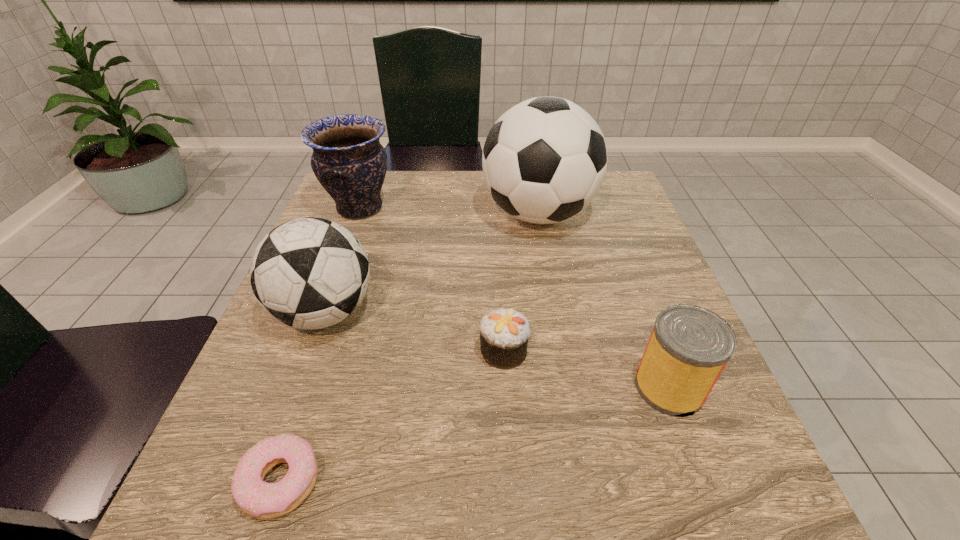
Where is `free space between the pottery and the cupcake`? free space between the pottery and the cupcake is located at coordinates (431, 280).

Locate which object is the second closest to the pottery. Please provide its 2D coordinates. Your answer should be formatted as a tuple, i.e. [(x, y)], where the tuple contains the x and y coordinates of a point satisfying the conditions above.

[(544, 160)]

Locate which object ranks third in proximity to the cupcake. Please provide its 2D coordinates. Your answer should be formatted as a tuple, i.e. [(x, y)], where the tuple contains the x and y coordinates of a point satisfying the conditions above.

[(544, 160)]

Image resolution: width=960 pixels, height=540 pixels. Identify the location of vacant region that satisfies the following two spatial constraints: 1. on the surface of the shorter soccer ball where the brand logo is visible; 2. on the left side of the third shortest object. (299, 387).

Locate an element on the screen. Image resolution: width=960 pixels, height=540 pixels. free space in the image that satisfies the following two spatial constraints: 1. on the front handle of the pottery; 2. on the right side of the tallest object is located at coordinates (358, 214).

Where is `free space that satisfies the following two spatial constraints: 1. on the front side of the can; 2. on the left side of the second shortest object`? The width and height of the screenshot is (960, 540). free space that satisfies the following two spatial constraints: 1. on the front side of the can; 2. on the left side of the second shortest object is located at coordinates (505, 387).

The image size is (960, 540). Identify the location of free spot that satisfies the following two spatial constraints: 1. on the back side of the can; 2. on the surface of the nearer soccer ball where the brand logo is visible. (641, 312).

Where is `vacant space that satisfies the following two spatial constraints: 1. on the front side of the cupcake; 2. on the left side of the can`? This screenshot has height=540, width=960. vacant space that satisfies the following two spatial constraints: 1. on the front side of the cupcake; 2. on the left side of the can is located at coordinates (505, 387).

Find the location of `vacant point that satisfies the following two spatial constraints: 1. on the surface of the left soccer ball where the brand logo is visible; 2. on the right side of the third shortest object`. vacant point that satisfies the following two spatial constraints: 1. on the surface of the left soccer ball where the brand logo is visible; 2. on the right side of the third shortest object is located at coordinates (299, 387).

Identify the location of blank area in the image that satisfies the following two spatial constraints: 1. on the front handle of the pottery; 2. on the back side of the tallest object. Image resolution: width=960 pixels, height=540 pixels. (358, 214).